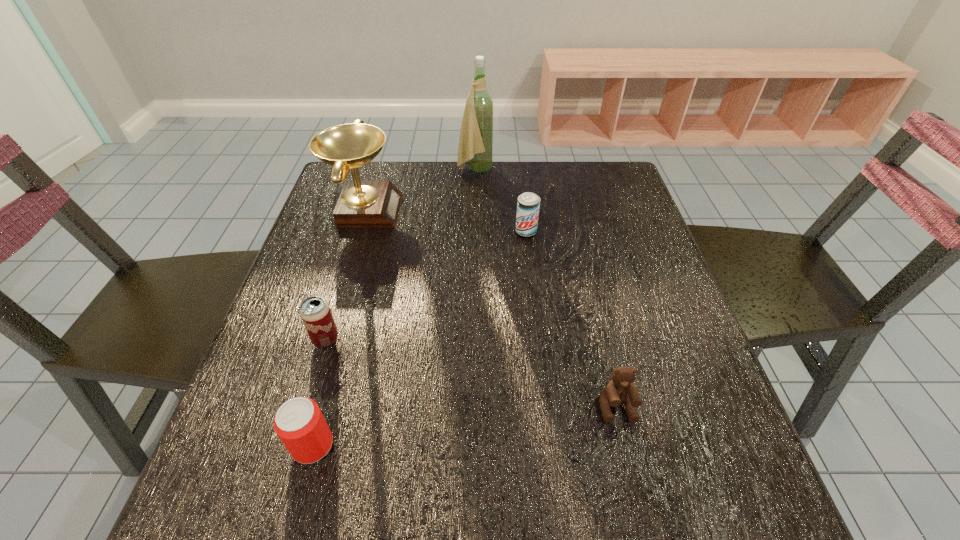
You are a GUI agent. You are given a task and a screenshot of the screen. Output one action in this format:
    pyautogui.click(x=<x>, y=<y>)
    Task: Click on the farthest object
    Image resolution: width=960 pixels, height=540 pixels.
    Given the screenshot: What is the action you would take?
    pyautogui.click(x=475, y=147)

You are a GUI agent. You are given a task and a screenshot of the screen. Output one action in this format:
    pyautogui.click(x=<x>, y=<y>)
    Task: Click on the wine bottle
    The image size is (960, 540).
    Given the screenshot: What is the action you would take?
    pyautogui.click(x=475, y=147)

The height and width of the screenshot is (540, 960). In order to click on award in this screenshot , I will do `click(362, 203)`.

Image resolution: width=960 pixels, height=540 pixels. What are the coordinates of `the fifth object from left to right` in the screenshot? It's located at (528, 204).

You are a GUI agent. You are given a task and a screenshot of the screen. Output one action in this format:
    pyautogui.click(x=<x>, y=<y>)
    Task: Click on the rightmost beer can
    Image resolution: width=960 pixels, height=540 pixels.
    Given the screenshot: What is the action you would take?
    pyautogui.click(x=528, y=204)

Find the location of a particular element. Image resolution: width=960 pixels, height=540 pixels. the nearest object is located at coordinates (299, 423).

Where is `the second nearest beer can`? This screenshot has height=540, width=960. the second nearest beer can is located at coordinates point(315,313).

Find the location of `teddy bear`. teddy bear is located at coordinates (620, 389).

The height and width of the screenshot is (540, 960). Identify the location of the fifth farthest object. (620, 389).

Image resolution: width=960 pixels, height=540 pixels. In order to click on vacant space situated 0.390m on the front-facing side of the farthest object in this screenshot , I will do `click(620, 170)`.